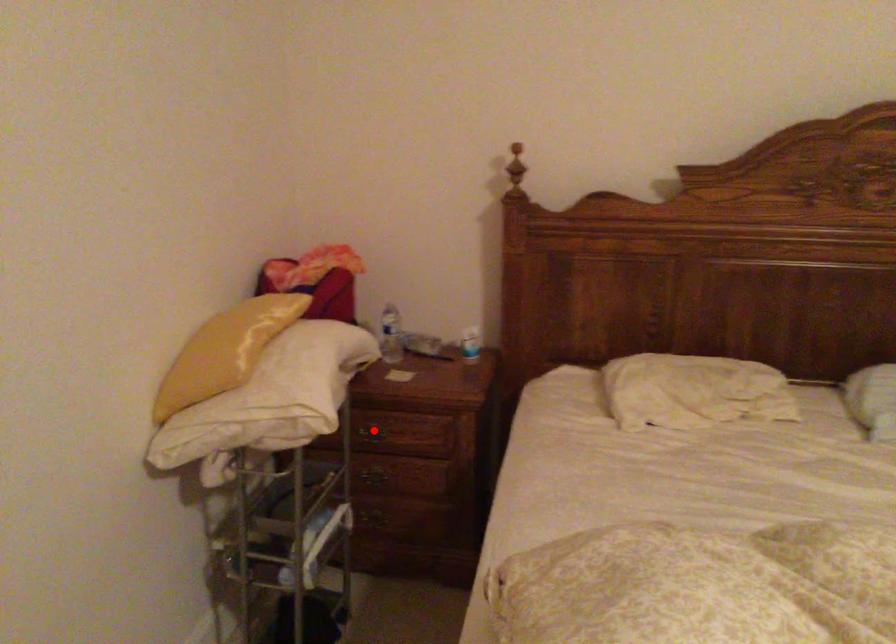
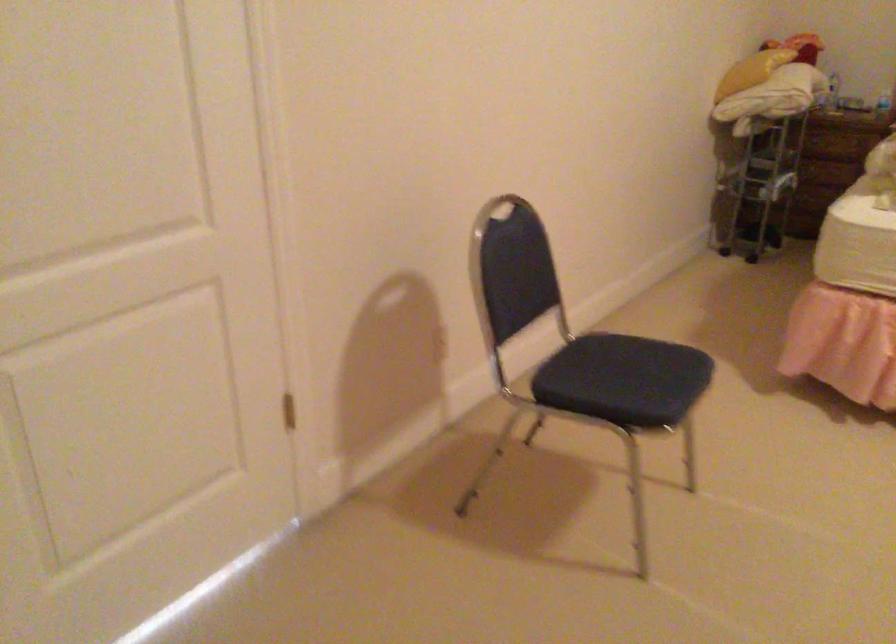
Question: I am providing you with two images of the same scene from different viewpoints. A red point is marked on the first image. Can you still see the location of the red point in image 2?

Choices:
 (A) Yes
 (B) No

Answer: (B)